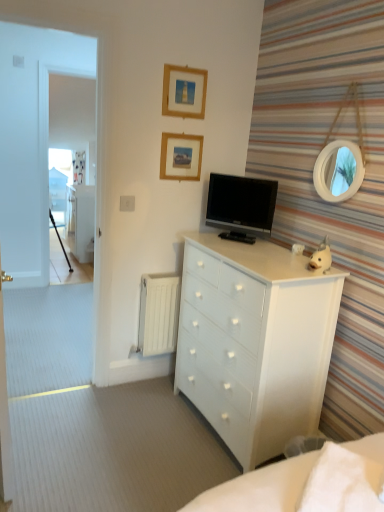
Question: From the image's perspective, is wooden picture frame at upper center, which is the 2th picture frame from top to bottom, beneath white glossy chest of drawers at center?

Choices:
 (A) no
 (B) yes

Answer: (A)

Question: Is wooden picture frame at upper center, which is the first picture frame from bottom to top, beside white glossy chest of drawers at center?

Choices:
 (A) yes
 (B) no

Answer: (B)

Question: Is wooden picture frame at upper center, which is the first picture frame from bottom to top, at the left side of white glossy chest of drawers at center?

Choices:
 (A) no
 (B) yes

Answer: (B)

Question: From a real-world perspective, is wooden picture frame at upper center, which is the 2th picture frame from top to bottom, physically above white glossy chest of drawers at center?

Choices:
 (A) yes
 (B) no

Answer: (A)

Question: Can you confirm if wooden picture frame at upper center, which is the 2th picture frame from top to bottom, is positioned to the right of white glossy chest of drawers at center?

Choices:
 (A) no
 (B) yes

Answer: (A)

Question: In the image, is white glossy chest of drawers at center positioned in front of or behind transparent glass door at left?

Choices:
 (A) front
 (B) behind

Answer: (A)

Question: Is white glossy chest of drawers at center wider or thinner than transparent glass door at left?

Choices:
 (A) wide
 (B) thin

Answer: (A)

Question: From the image's perspective, relative to transparent glass door at left, is white glossy chest of drawers at center above or below?

Choices:
 (A) above
 (B) below

Answer: (B)

Question: Considering the relative positions of white glossy chest of drawers at center and transparent glass door at left in the image provided, is white glossy chest of drawers at center to the left or to the right of transparent glass door at left?

Choices:
 (A) right
 (B) left

Answer: (A)

Question: Is white glossy file cabinet at left wider or thinner than wooden picture frame at upper center, which appears as the first picture frame when viewed from the top?

Choices:
 (A) thin
 (B) wide

Answer: (B)

Question: In terms of height, does white glossy file cabinet at left look taller or shorter compared to wooden picture frame at upper center, which is counted as the 2th picture frame, starting from the bottom?

Choices:
 (A) tall
 (B) short

Answer: (A)

Question: Is white glossy file cabinet at left spatially inside wooden picture frame at upper center, which appears as the first picture frame when viewed from the top, or outside of it?

Choices:
 (A) inside
 (B) outside

Answer: (B)

Question: Considering their positions, is white glossy file cabinet at left located in front of or behind wooden picture frame at upper center, which is counted as the 2th picture frame, starting from the bottom?

Choices:
 (A) front
 (B) behind

Answer: (B)

Question: From the image's perspective, relative to white matte radiator at lower left, is white glossy chest of drawers at center above or below?

Choices:
 (A) above
 (B) below

Answer: (B)

Question: Which is correct: white glossy chest of drawers at center is inside white matte radiator at lower left, or outside of it?

Choices:
 (A) inside
 (B) outside

Answer: (B)